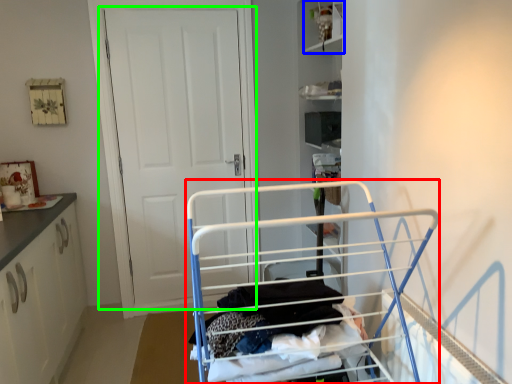
Question: Which object is positioned closest to baby carriage (highlighted by a red box)? Select from cabinet (highlighted by a blue box) and door (highlighted by a green box).

Choices:
 (A) cabinet
 (B) door

Answer: (B)